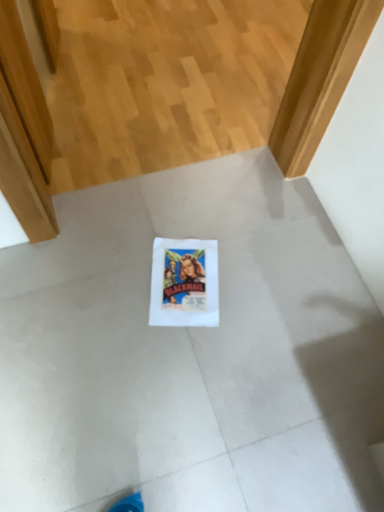
Image resolution: width=384 pixels, height=512 pixels. What are the coordinates of `vacant area on top of white paper flyer at center (from a real-world perspective)` in the screenshot? It's located at (184, 270).